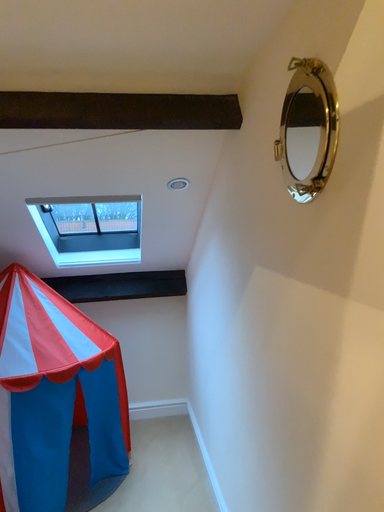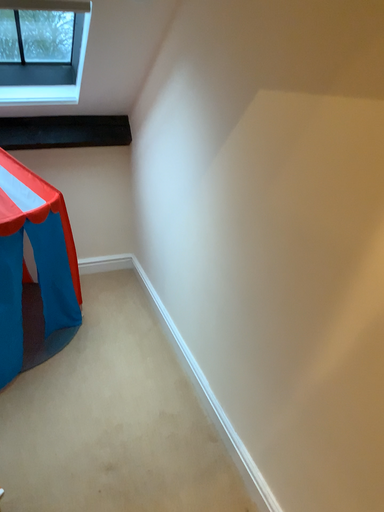
Question: Which way did the camera rotate in the video?

Choices:
 (A) rotated downward
 (B) rotated upward

Answer: (A)